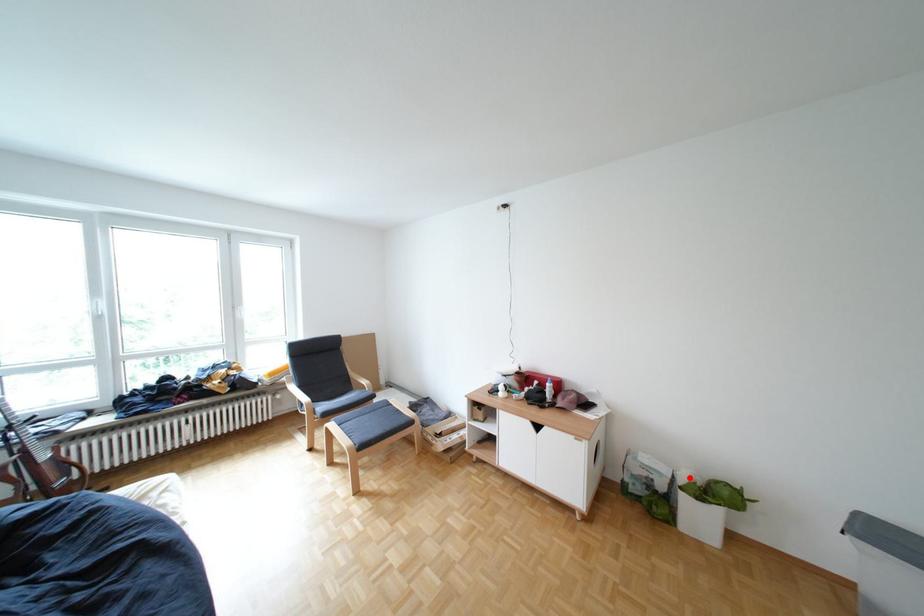
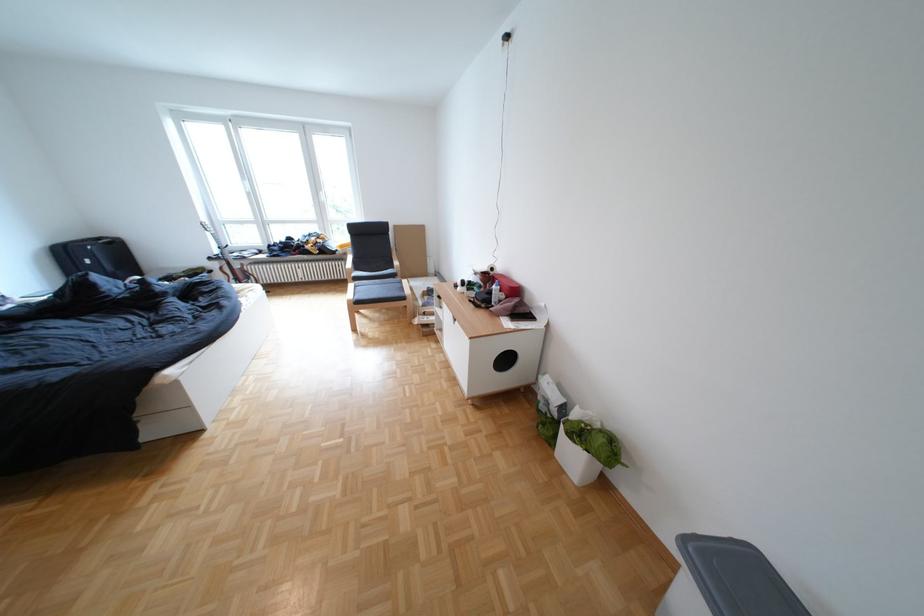
Locate, in the second image, the point that corresponds to the highlighted location in the first image.

(579, 408)